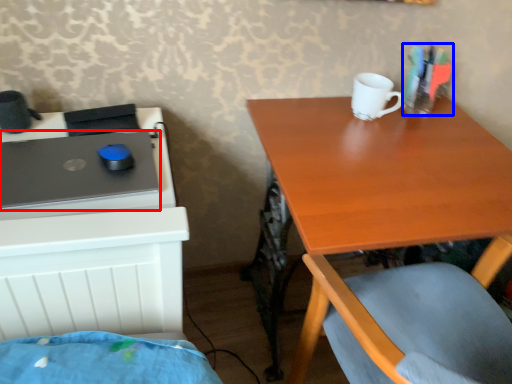
Question: Which object is further to the camera taking this photo, laptop (highlighted by a red box) or stationery (highlighted by a blue box)?

Choices:
 (A) laptop
 (B) stationery

Answer: (B)